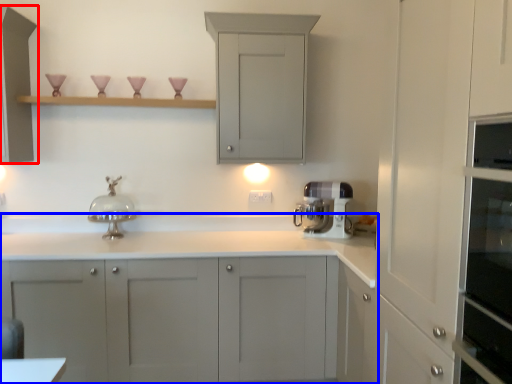
Question: Which object is further to the camera taking this photo, cabinetry (highlighted by a red box) or cabinetry (highlighted by a blue box)?

Choices:
 (A) cabinetry
 (B) cabinetry

Answer: (A)